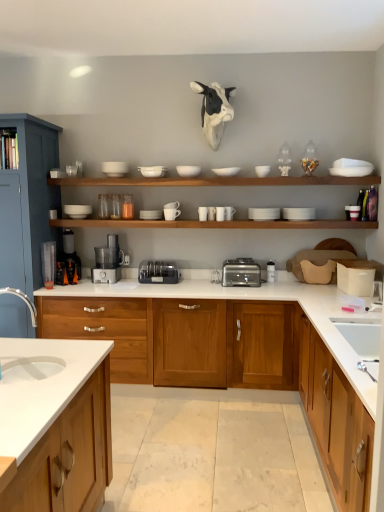
The height and width of the screenshot is (512, 384). What are the coordinates of `free area behind white glossy sink at lower left, which appears as the second sink when viewed from the back` in the screenshot? It's located at (28, 357).